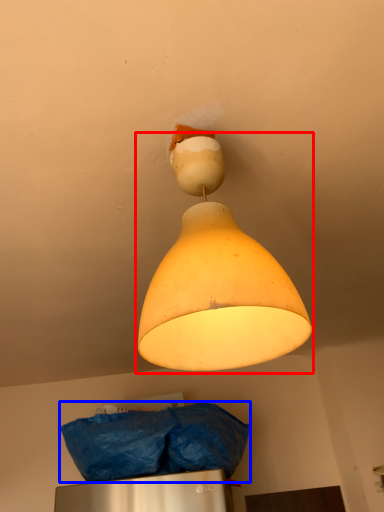
Question: Which object is further to the camera taking this photo, lamp (highlighted by a red box) or material (highlighted by a blue box)?

Choices:
 (A) lamp
 (B) material

Answer: (B)